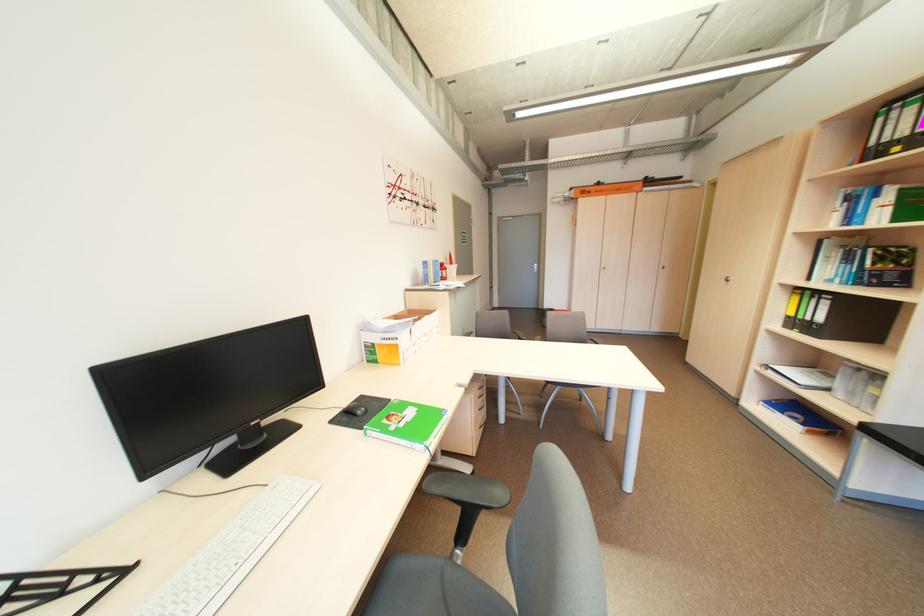
The height and width of the screenshot is (616, 924). What do you see at coordinates (537, 268) in the screenshot?
I see `a silver door handle` at bounding box center [537, 268].